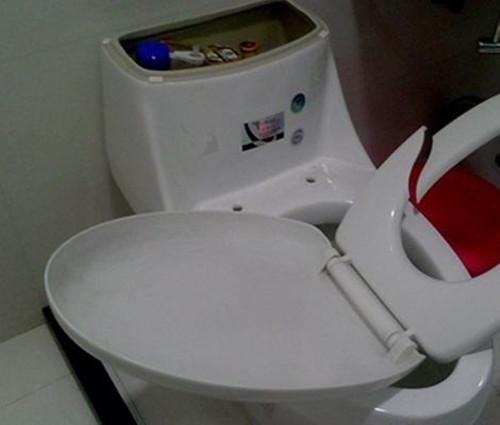
This screenshot has width=500, height=425. I want to click on top of toilet cover, so click(x=162, y=310).